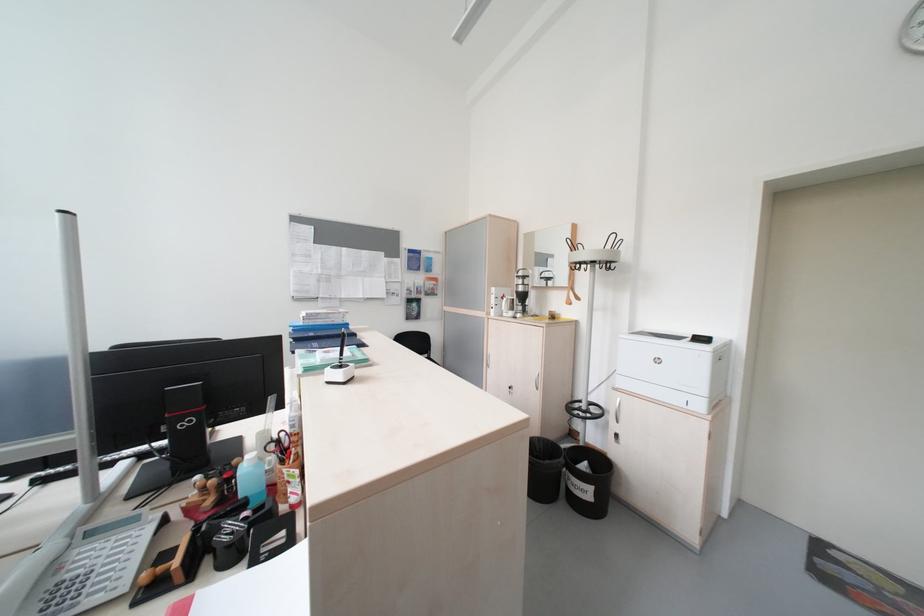
Locate an element on the screen. This screenshot has height=616, width=924. glass coffee carafe is located at coordinates (521, 291).